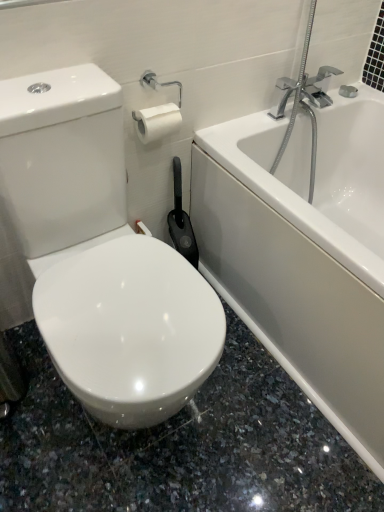
Question: Considering the positions of white glossy bathtub at upper right and white glossy toilet at center in the image, is white glossy bathtub at upper right taller or shorter than white glossy toilet at center?

Choices:
 (A) tall
 (B) short

Answer: (B)

Question: Is white glossy bathtub at upper right in front of or behind white glossy toilet at center in the image?

Choices:
 (A) behind
 (B) front

Answer: (A)

Question: Is point (382, 176) closer or farther from the camera than point (152, 404)?

Choices:
 (A) closer
 (B) farther

Answer: (B)

Question: From their relative heights in the image, would you say white glossy toilet at center is taller or shorter than white glossy bathtub at upper right?

Choices:
 (A) tall
 (B) short

Answer: (A)

Question: From the image's perspective, is white glossy toilet at center above or below white glossy bathtub at upper right?

Choices:
 (A) above
 (B) below

Answer: (B)

Question: From a real-world perspective, is white glossy toilet at center physically located above or below white glossy bathtub at upper right?

Choices:
 (A) below
 (B) above

Answer: (B)

Question: In the image, is white glossy toilet at center positioned in front of or behind white glossy bathtub at upper right?

Choices:
 (A) behind
 (B) front

Answer: (B)